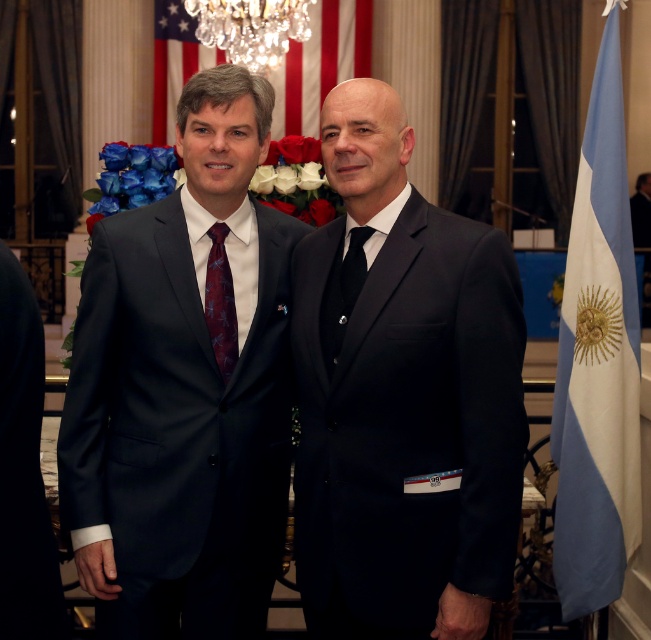
From the picture: You are a photographer setting up for a group photo in a large room. You need to position the black matte suit at center and the crystal glass chandelier at upper center. The minimum distance required between the subjects and the chandelier for proper lighting is 25 feet. Will the current distance of 27.80 feet between them meet this requirement?

The distance between the black matte suit at center and the crystal glass chandelier at upper center is 27.80 feet, which exceeds the minimum requirement of 25 feet. Therefore, the current distance meets the requirement for proper lighting.